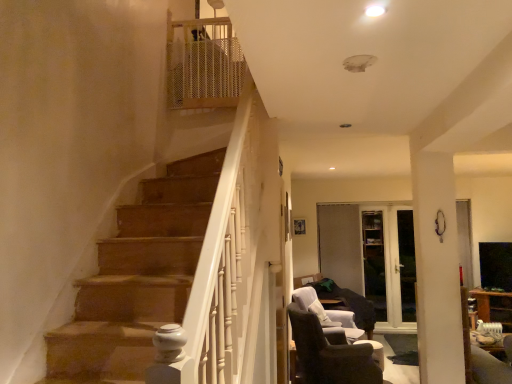
Question: Can you confirm if transparent glass door at center, positioned as the 2th glass door in right-to-left order, is smaller than dark brown fabric chair at lower right, acting as the 2th chair starting from the front?

Choices:
 (A) yes
 (B) no

Answer: (A)

Question: From a real-world perspective, is transparent glass door at center, which is the first glass door from left to right, physically below dark brown fabric chair at lower right, acting as the 2th chair starting from the front?

Choices:
 (A) no
 (B) yes

Answer: (A)

Question: From the image's perspective, is transparent glass door at center, positioned as the 2th glass door in right-to-left order, on dark brown fabric chair at lower right, which appears as the 1th chair when viewed from the back?

Choices:
 (A) no
 (B) yes

Answer: (B)

Question: Is dark brown fabric chair at lower right, acting as the 2th chair starting from the front, completely or partially inside transparent glass door at center, which is the first glass door from left to right?

Choices:
 (A) no
 (B) yes

Answer: (A)

Question: Can you confirm if transparent glass door at center, which is the first glass door from left to right, is shorter than dark brown fabric chair at lower right, acting as the 2th chair starting from the front?

Choices:
 (A) no
 (B) yes

Answer: (A)

Question: Based on their sizes in the image, would you say white glossy ceiling light at upper center is bigger or smaller than transparent glass door at center, placed as the 1th glass door when sorted from right to left?

Choices:
 (A) small
 (B) big

Answer: (A)

Question: From their relative heights in the image, would you say white glossy ceiling light at upper center is taller or shorter than transparent glass door at center, placed as the 1th glass door when sorted from right to left?

Choices:
 (A) tall
 (B) short

Answer: (B)

Question: Is point (379, 9) positioned closer to the camera than point (403, 319)?

Choices:
 (A) closer
 (B) farther

Answer: (A)

Question: From a real-world perspective, relative to transparent glass door at center, which ranks as the second glass door in left-to-right order, is white glossy ceiling light at upper center vertically above or below?

Choices:
 (A) below
 (B) above

Answer: (B)

Question: Is dark brown fabric chair at lower right, acting as the 2th chair starting from the front, in front of or behind transparent glass door at center, positioned as the 2th glass door in right-to-left order, in the image?

Choices:
 (A) behind
 (B) front

Answer: (B)

Question: Is point (294, 301) positioned closer to the camera than point (367, 261)?

Choices:
 (A) closer
 (B) farther

Answer: (A)

Question: From a real-world perspective, is dark brown fabric chair at lower right, which appears as the 1th chair when viewed from the back, positioned above or below transparent glass door at center, which is the first glass door from left to right?

Choices:
 (A) above
 (B) below

Answer: (B)

Question: Is dark brown fabric chair at lower right, acting as the 2th chair starting from the front, taller or shorter than transparent glass door at center, positioned as the 2th glass door in right-to-left order?

Choices:
 (A) short
 (B) tall

Answer: (A)

Question: In terms of width, does white glossy ceiling light at upper center look wider or thinner when compared to dark brown fabric chair at lower right, which is the 2th chair from back to front?

Choices:
 (A) thin
 (B) wide

Answer: (A)

Question: From their relative heights in the image, would you say white glossy ceiling light at upper center is taller or shorter than dark brown fabric chair at lower right, the first chair in the front-to-back sequence?

Choices:
 (A) tall
 (B) short

Answer: (B)